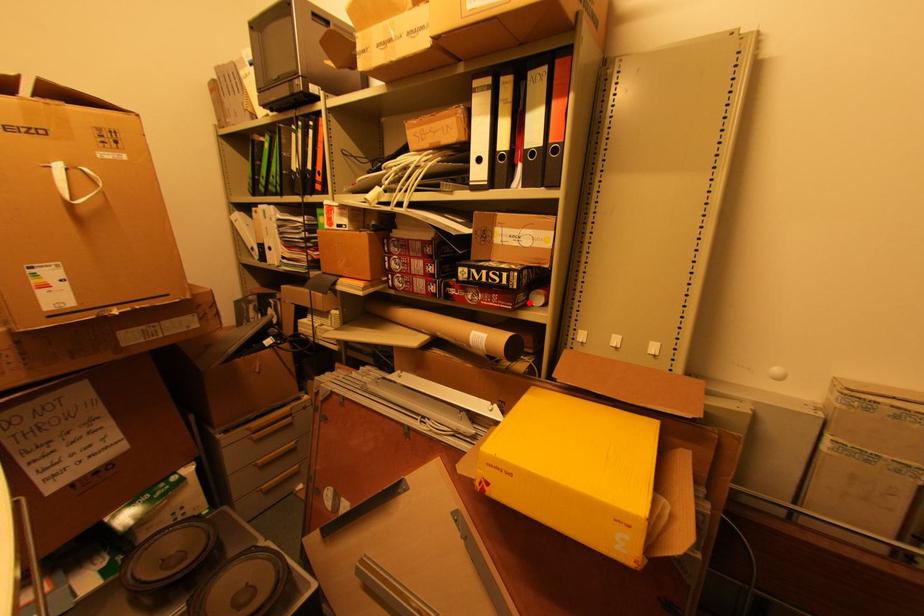
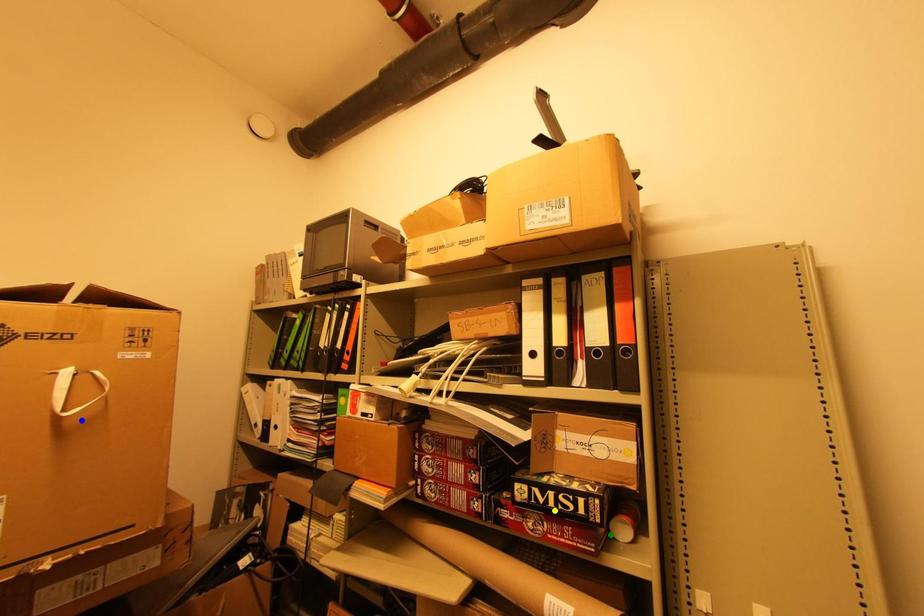
Question: I am providing you with two images of the same scene from different viewpoints. A red point is marked on the first image. You are given multiple points on the second image. In image 2, which mark is for the same physical point as the one in image 1?

Choices:
 (A) green point
 (B) blue point
 (C) yellow point

Answer: (A)